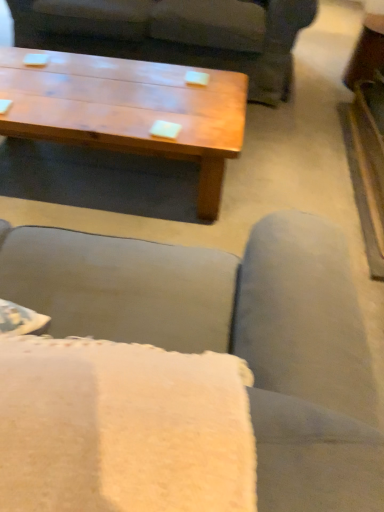
Question: Is matte gray couch at center shorter than wooden coffee table at upper center?

Choices:
 (A) yes
 (B) no

Answer: (B)

Question: Does matte gray couch at center contain wooden coffee table at upper center?

Choices:
 (A) yes
 (B) no

Answer: (B)

Question: Does matte gray couch at center lie in front of wooden coffee table at upper center?

Choices:
 (A) no
 (B) yes

Answer: (A)

Question: Is matte gray couch at center at the right side of wooden coffee table at upper center?

Choices:
 (A) no
 (B) yes

Answer: (B)

Question: Is the depth of matte gray couch at center greater than that of wooden coffee table at upper center?

Choices:
 (A) no
 (B) yes

Answer: (B)

Question: Can you confirm if matte gray couch at center is taller than wooden coffee table at upper center?

Choices:
 (A) no
 (B) yes

Answer: (B)

Question: Considering the relative sizes of wooden coffee table at upper center and matte gray couch at center in the image provided, is wooden coffee table at upper center bigger than matte gray couch at center?

Choices:
 (A) yes
 (B) no

Answer: (B)

Question: Can you confirm if wooden coffee table at upper center is positioned to the right of matte gray couch at center?

Choices:
 (A) yes
 (B) no

Answer: (B)

Question: Is wooden coffee table at upper center wider than matte gray couch at center?

Choices:
 (A) no
 (B) yes

Answer: (A)

Question: Is matte gray couch at center at the back of wooden coffee table at upper center?

Choices:
 (A) yes
 (B) no

Answer: (A)

Question: Considering the relative sizes of wooden coffee table at upper center and matte gray couch at center in the image provided, is wooden coffee table at upper center smaller than matte gray couch at center?

Choices:
 (A) no
 (B) yes

Answer: (B)

Question: Considering the relative sizes of wooden coffee table at upper center and matte gray couch at center in the image provided, is wooden coffee table at upper center shorter than matte gray couch at center?

Choices:
 (A) yes
 (B) no

Answer: (A)

Question: From a real-world perspective, is wooden coffee table at upper center physically located above or below matte gray couch at center?

Choices:
 (A) below
 (B) above

Answer: (A)